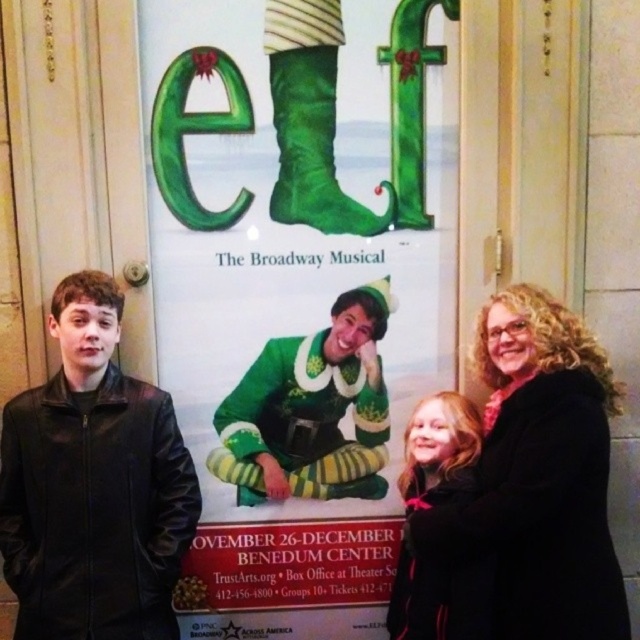
Question: Which of the following is the closest to the observer?

Choices:
 (A) (518, 316)
 (B) (148, 548)

Answer: (A)

Question: Can you confirm if black leather jacket at left is positioned below green felt boot at center?

Choices:
 (A) yes
 (B) no

Answer: (A)

Question: Can you confirm if green felt boots at center is positioned below black leather jacket at left?

Choices:
 (A) yes
 (B) no

Answer: (B)

Question: Among these points, which one is farthest from the camera?

Choices:
 (A) (237, 461)
 (B) (65, 508)
 (C) (508, 400)
 (D) (291, 204)

Answer: (A)

Question: Can you confirm if black wool coat at right is positioned to the right of green fuzzy sweater at center?

Choices:
 (A) yes
 (B) no

Answer: (A)

Question: Which of the following is the closest to the observer?

Choices:
 (A) (236, 596)
 (B) (572, 317)
 (C) (234, 483)

Answer: (B)